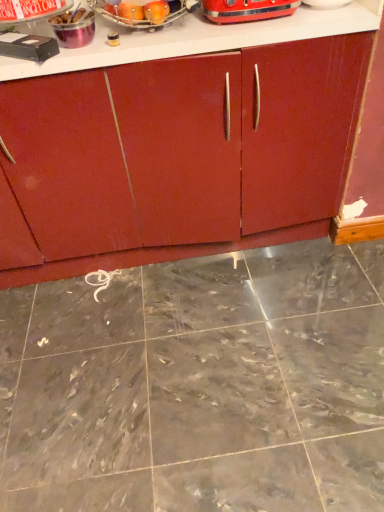
Where is `free space in front of metallic silver container at upper left, the third appliance positioned from the left`? free space in front of metallic silver container at upper left, the third appliance positioned from the left is located at coordinates (74, 53).